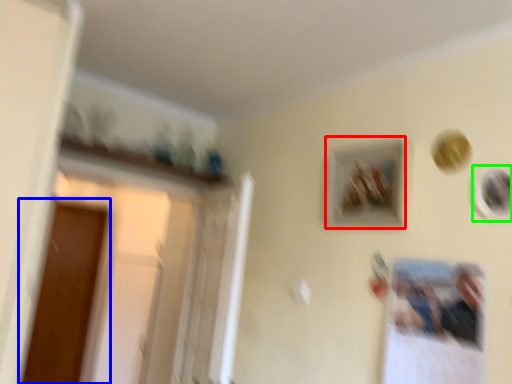
Question: Which is farther away from picture frame (highlighted by a red box)? screen door (highlighted by a blue box) or picture frame (highlighted by a green box)?

Choices:
 (A) screen door
 (B) picture frame

Answer: (A)